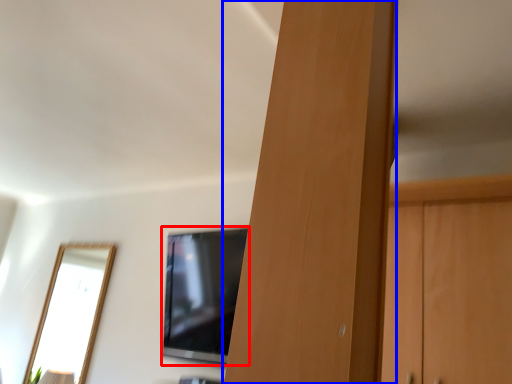
Question: Which of the following is the farthest to the observer, television (highlighted by a red box) or door (highlighted by a blue box)?

Choices:
 (A) television
 (B) door

Answer: (A)